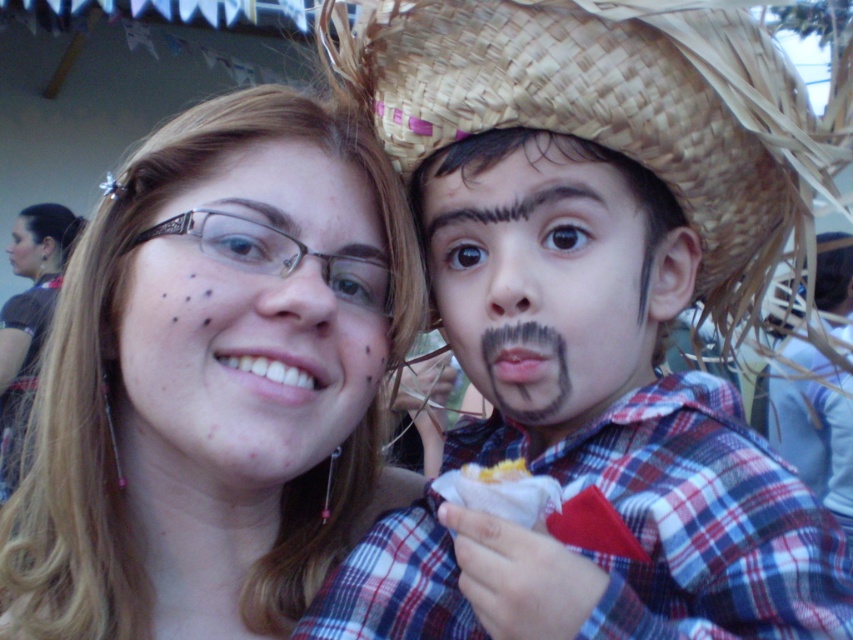
Between matte black hair at upper left and black hair at upper left, which one appears on the left side from the viewer's perspective?

black hair at upper left

Does matte black hair at upper left have a greater width compared to black hair at upper left?

Incorrect, matte black hair at upper left's width does not surpass black hair at upper left's.

Is point (209, 154) farther from viewer compared to point (68, 252)?

No, (209, 154) is closer to viewer.

Image resolution: width=853 pixels, height=640 pixels. I want to click on matte black hair at upper left, so click(x=216, y=381).

Does black matte mustache at center appear over yellow crumbly food at lower center?

Yes, black matte mustache at center is above yellow crumbly food at lower center.

Looking at this image, can you confirm if black matte mustache at center is bigger than yellow crumbly food at lower center?

Yes.

Does point (643, 260) come closer to viewer compared to point (505, 460)?

Yes, it is.

I want to click on black matte mustache at center, so click(540, 275).

How distant is plaid fabric shirt at center from smooth skin face at center?

plaid fabric shirt at center and smooth skin face at center are 11.86 feet apart.

Is plaid fabric shirt at center above smooth skin face at center?

Incorrect, plaid fabric shirt at center is not positioned above smooth skin face at center.

This screenshot has width=853, height=640. In order to click on plaid fabric shirt at center in this screenshot , I will do `click(585, 428)`.